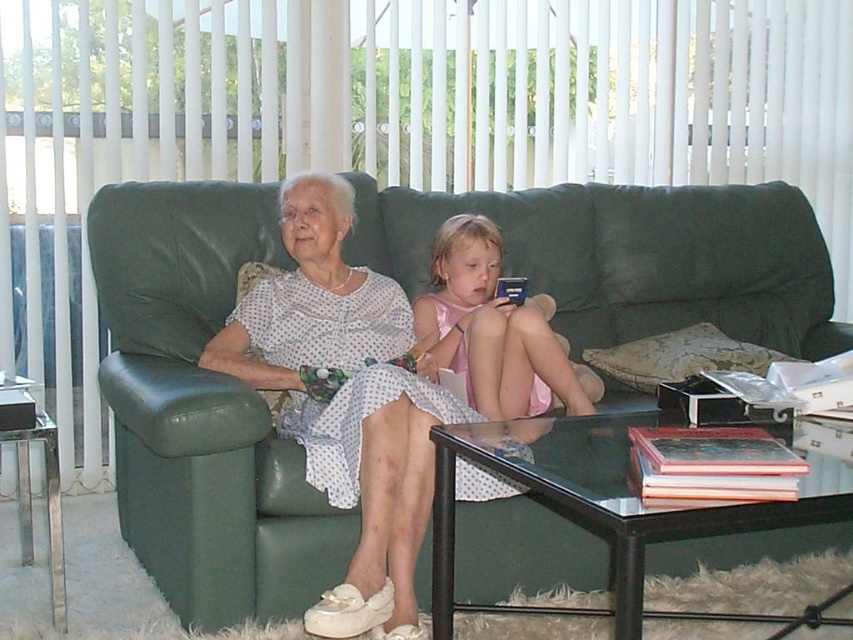
Question: Is green leather couch at center smaller than pink satin dress at center?

Choices:
 (A) yes
 (B) no

Answer: (B)

Question: From the image, what is the correct spatial relationship of matte white dress at center in relation to pink satin dress at center?

Choices:
 (A) right
 (B) left

Answer: (B)

Question: Among these points, which one is nearest to the camera?

Choices:
 (A) (457, 244)
 (B) (343, 564)
 (C) (379, 348)

Answer: (B)

Question: Is green leather couch at center closer to camera compared to pink satin dress at center?

Choices:
 (A) no
 (B) yes

Answer: (B)

Question: Which object is farther from the camera taking this photo?

Choices:
 (A) pink satin dress at center
 (B) green leather couch at center
 (C) matte white dress at center

Answer: (A)

Question: Among these points, which one is nearest to the camera?

Choices:
 (A) (334, 429)
 (B) (608, 272)
 (C) (416, 316)

Answer: (A)